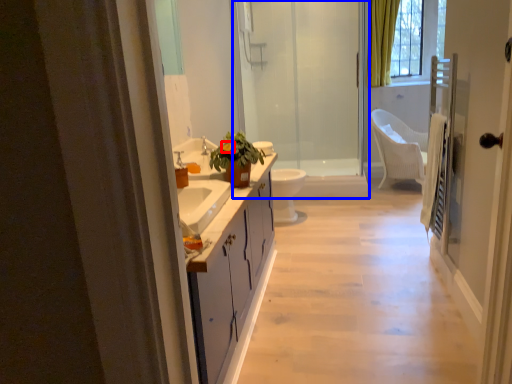
Question: Which object appears closest to the camera in this image, flower (highlighted by a red box) or shower door (highlighted by a blue box)?

Choices:
 (A) flower
 (B) shower door

Answer: (A)